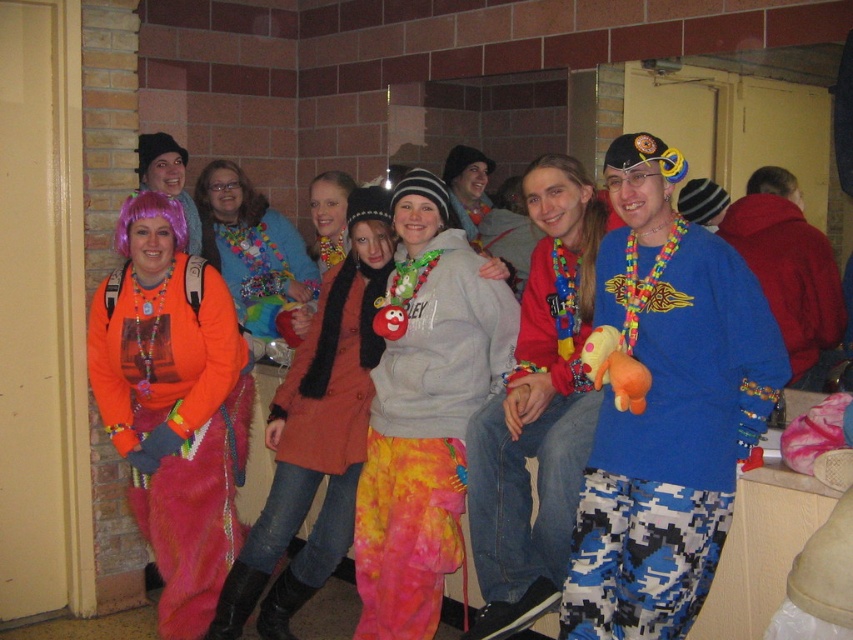
Question: Which object is closer to the camera taking this photo?

Choices:
 (A) tie-dye fabric pants at center
 (B) shiny purple wig at center

Answer: (A)

Question: Does orange fleece jacket at center lie behind orange fabric coat at center?

Choices:
 (A) yes
 (B) no

Answer: (A)

Question: Among these objects, which one is farthest from the camera?

Choices:
 (A) matte orange sweater at center
 (B) orange fleece jacket at center

Answer: (A)

Question: Can you confirm if matte orange sweater at center is smaller than shiny purple wig at center?

Choices:
 (A) no
 (B) yes

Answer: (A)

Question: Estimate the real-world distances between objects in this image. Which object is farther from the shiny purple wig at center?

Choices:
 (A) tie-dye fabric pants at center
 (B) orange fleece jacket at center
 (C) blue digital camouflage pants at right
 (D) camouflage pants at center

Answer: (C)

Question: Is orange fleece jacket at center positioned at the back of tie-dye fabric pants at center?

Choices:
 (A) no
 (B) yes

Answer: (B)